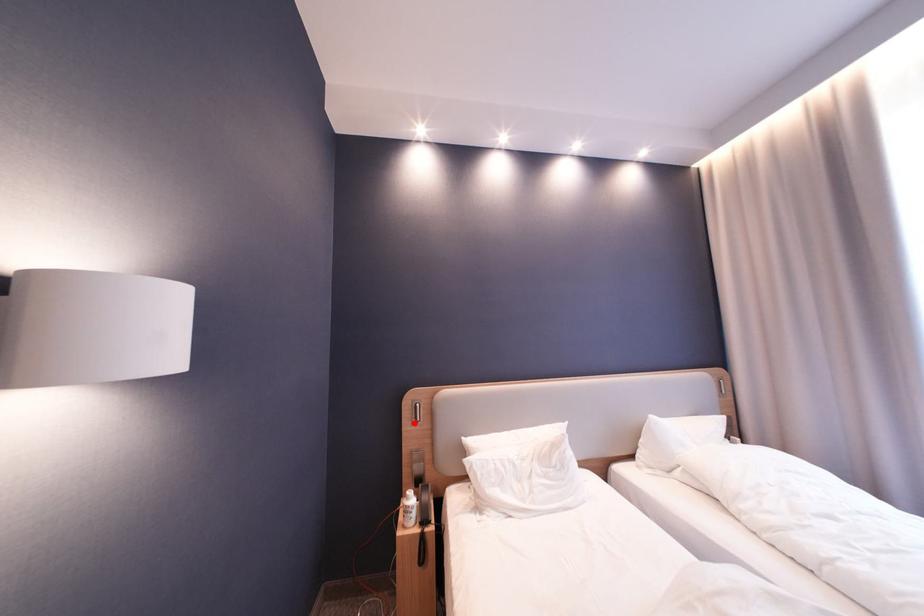
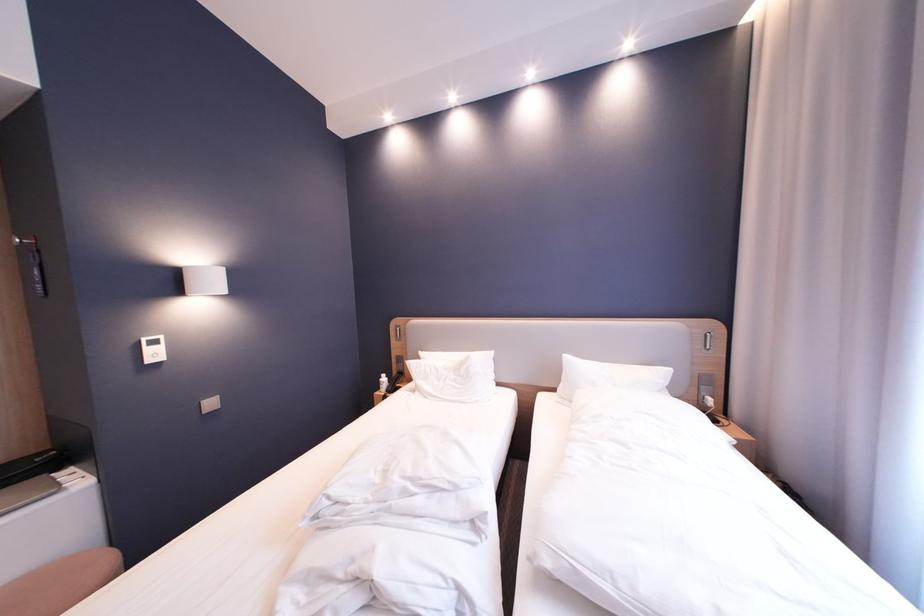
In the second image, find the point that corresponds to the highlighted location in the first image.

(403, 339)